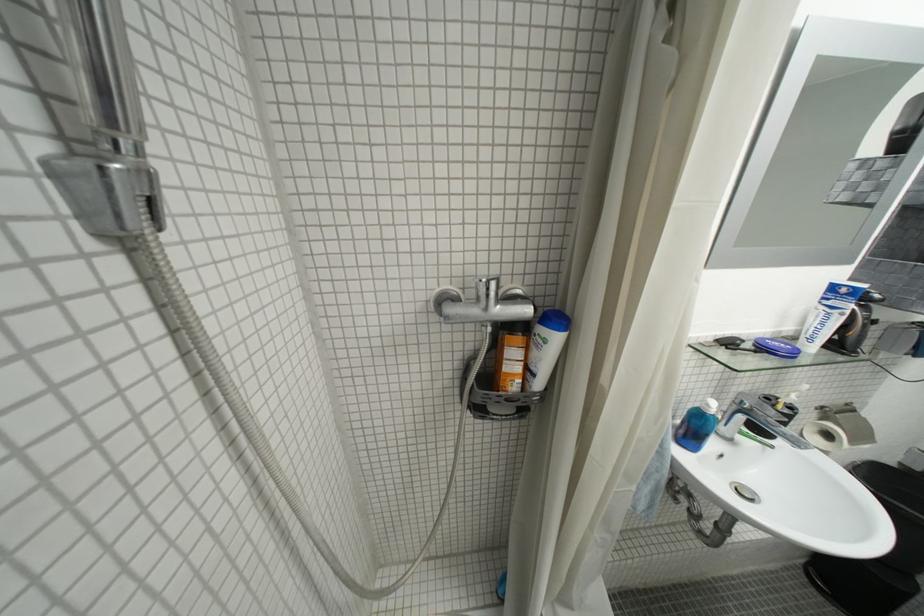
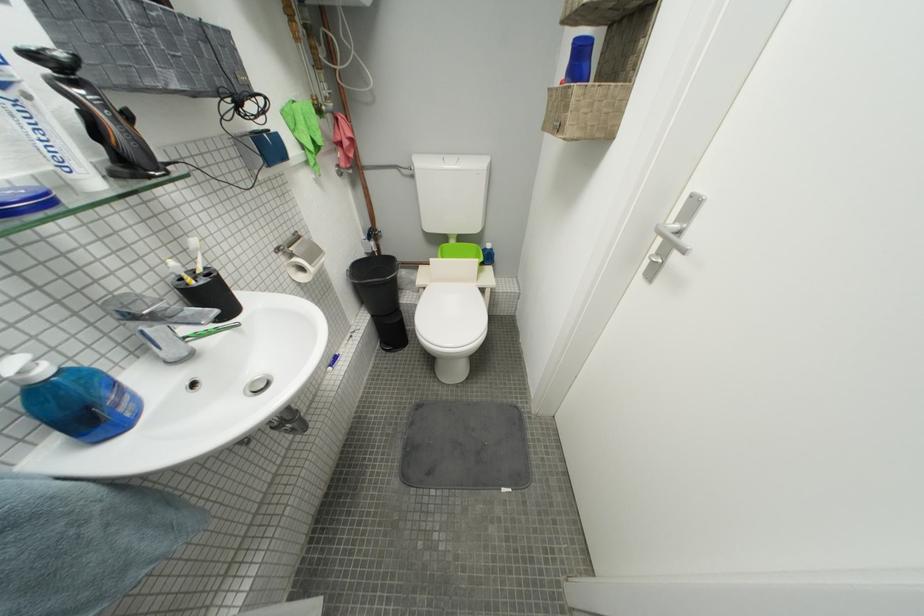
Locate, in the second image, the point that corresponds to (x=861, y=444) in the first image.

(320, 265)